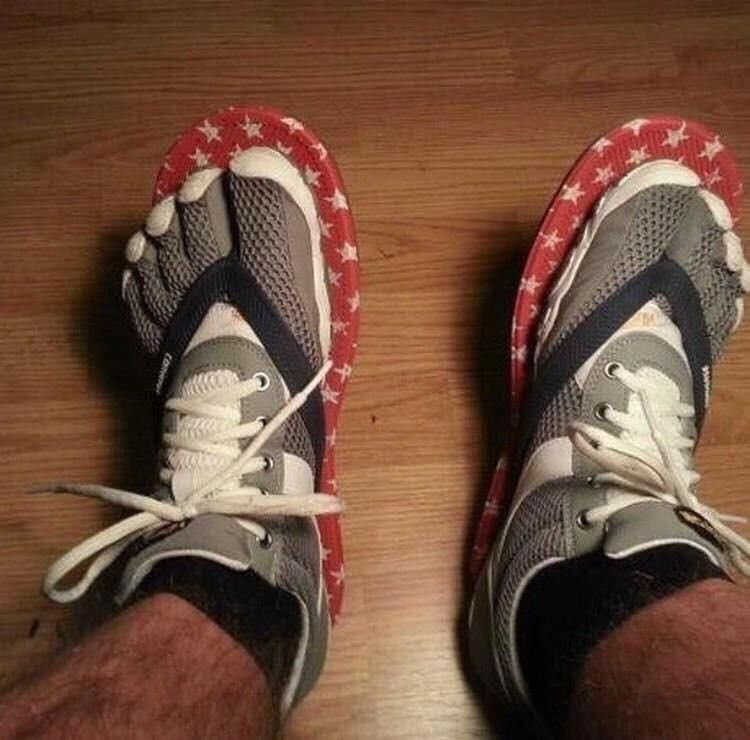
Locate an element on the screen. The image size is (750, 740). wooden floor is located at coordinates (412, 240).